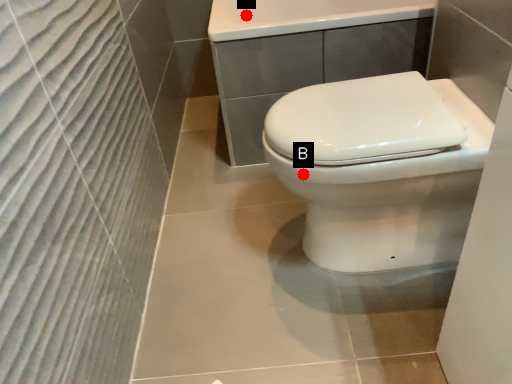
Question: Two points are circled on the image, labeled by A and B beside each circle. Which of the following is the farthest from the observer?

Choices:
 (A) A is further
 (B) B is further

Answer: (A)